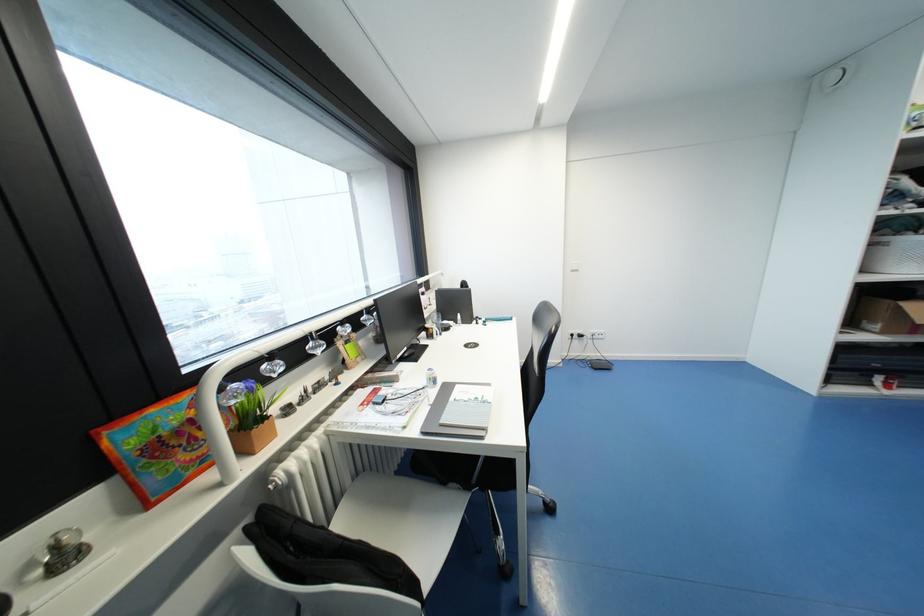
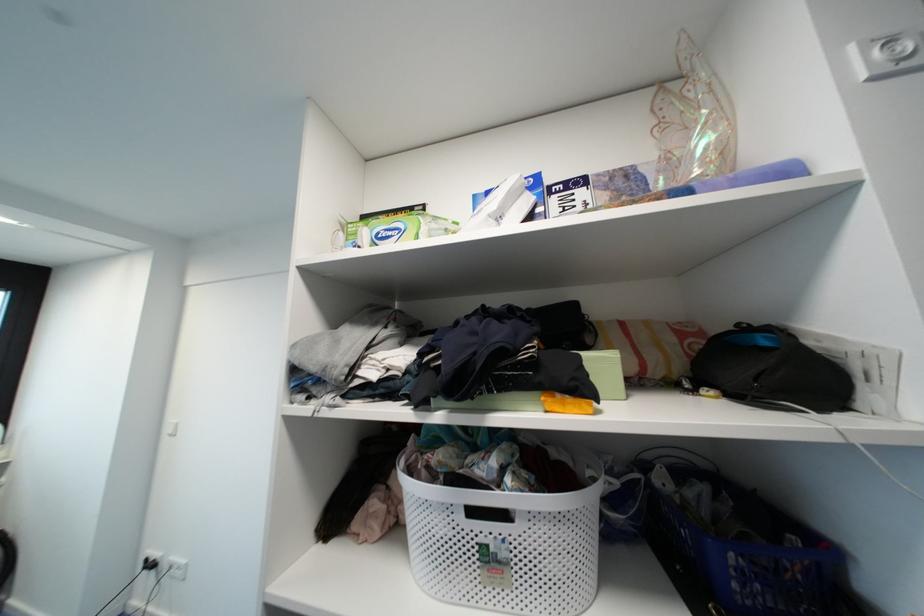
Question: The images are taken continuously from a first-person perspective. In which direction are you moving?

Choices:
 (A) Left
 (B) Right
 (C) Forward
 (D) Backward

Answer: (B)